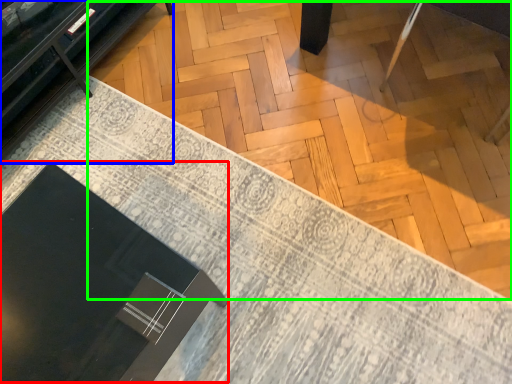
Question: Estimate the real-world distances between objects in this image. Which object is farther from round table (highlighted by a red box), furniture (highlighted by a blue box) or plywood (highlighted by a green box)?

Choices:
 (A) furniture
 (B) plywood

Answer: (B)